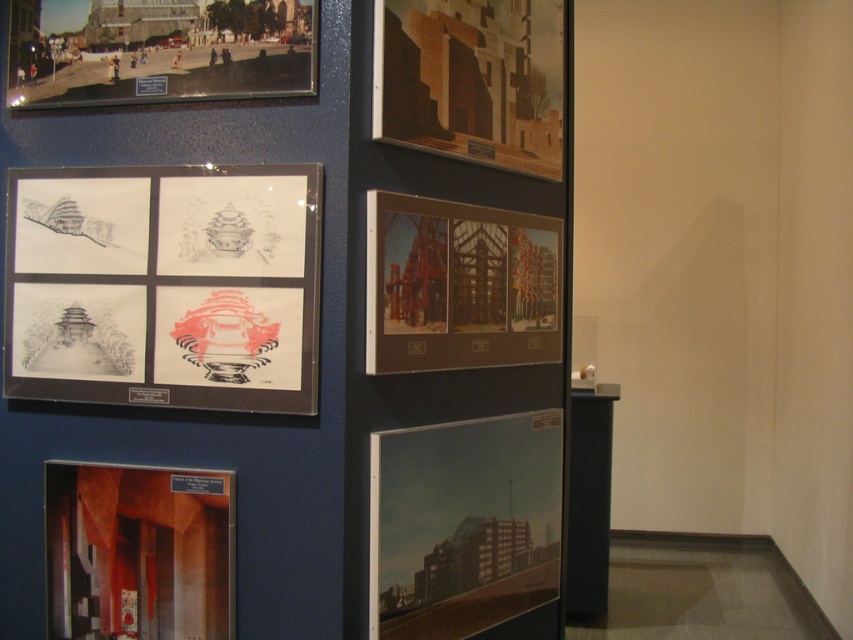
Question: Which point appears farthest from the camera in this image?

Choices:
 (A) (386, 214)
 (B) (480, 29)

Answer: (B)

Question: Considering the relative positions of matte paper drawings at center left and matte black photograph at upper left in the image provided, where is matte paper drawings at center left located with respect to matte black photograph at upper left?

Choices:
 (A) below
 (B) above

Answer: (A)

Question: Which object is the closest to the matte black photograph at upper left?

Choices:
 (A) matte paper drawings at center left
 (B) wooden panel at upper center
 (C) matte glass building at lower center
 (D) matte brown wooden frame at center

Answer: (A)

Question: Is matte paper drawings at center left bigger than wooden panel at upper center?

Choices:
 (A) yes
 (B) no

Answer: (B)

Question: Which object is closer to the camera taking this photo?

Choices:
 (A) matte black photograph at upper left
 (B) wooden panel at upper center

Answer: (A)

Question: From the image, what is the correct spatial relationship of matte paper drawings at center left in relation to matte brown paper at lower left?

Choices:
 (A) below
 (B) above

Answer: (B)